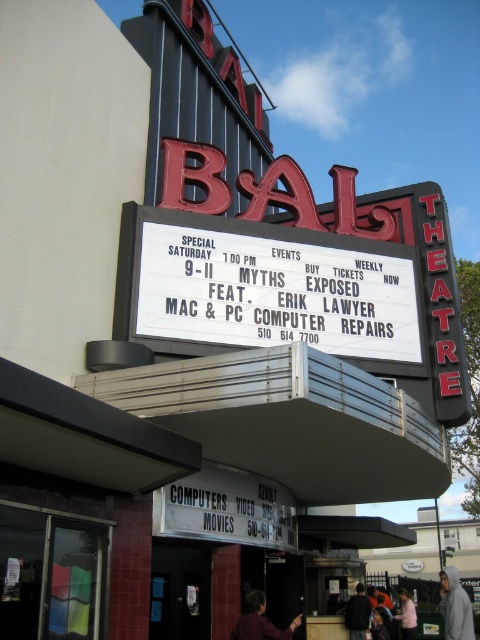
Which is more to the right, dark gray sweater at lower right or pink fabric shirt at lower right?

pink fabric shirt at lower right is more to the right.

You are a GUI agent. You are given a task and a screenshot of the screen. Output one action in this format:
    pyautogui.click(x=<x>, y=<y>)
    Task: Click on the dark gray sweater at lower right
    The width and height of the screenshot is (480, 640).
    Given the screenshot: What is the action you would take?
    pyautogui.click(x=358, y=612)

Which is more to the right, brown leather jacket at lower center or pink fabric shirt at lower right?

pink fabric shirt at lower right is more to the right.

The width and height of the screenshot is (480, 640). Describe the element at coordinates (261, 620) in the screenshot. I see `brown leather jacket at lower center` at that location.

You are a GUI agent. You are given a task and a screenshot of the screen. Output one action in this format:
    pyautogui.click(x=<x>, y=<y>)
    Task: Click on the brown leather jacket at lower center
    This screenshot has width=480, height=640.
    Given the screenshot: What is the action you would take?
    pyautogui.click(x=261, y=620)

Is point (287, 634) more distant than point (357, 602)?

No, it is in front of (357, 602).

Who is lower down, brown leather jacket at lower center or dark gray sweater at lower right?

dark gray sweater at lower right is lower down.

Which is behind, point (236, 628) or point (361, 596)?

Point (361, 596)

At what (x,y) coordinates should I click in order to perform the action: click on brown leather jacket at lower center. Please return your answer as a coordinate pair (x, y). This screenshot has width=480, height=640. Looking at the image, I should click on (261, 620).